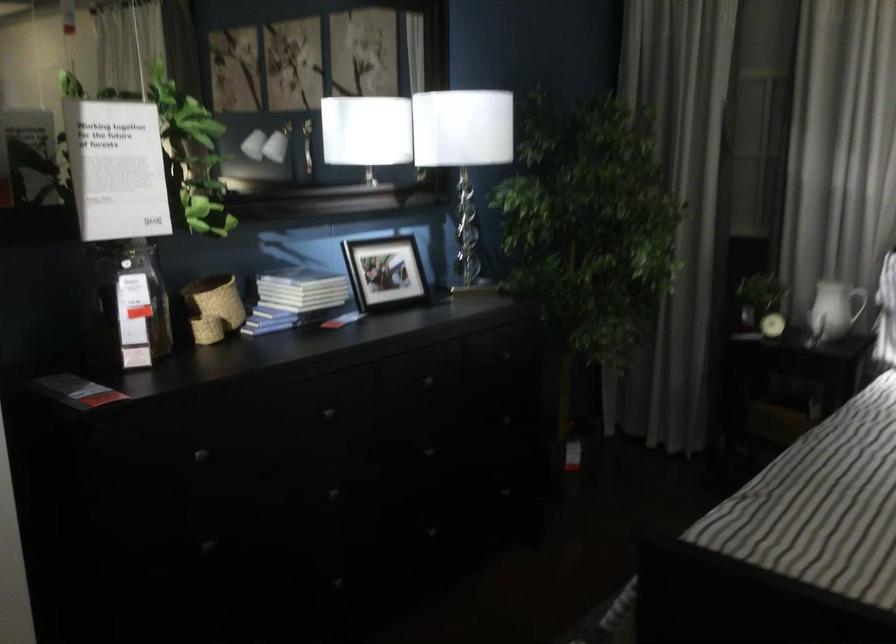
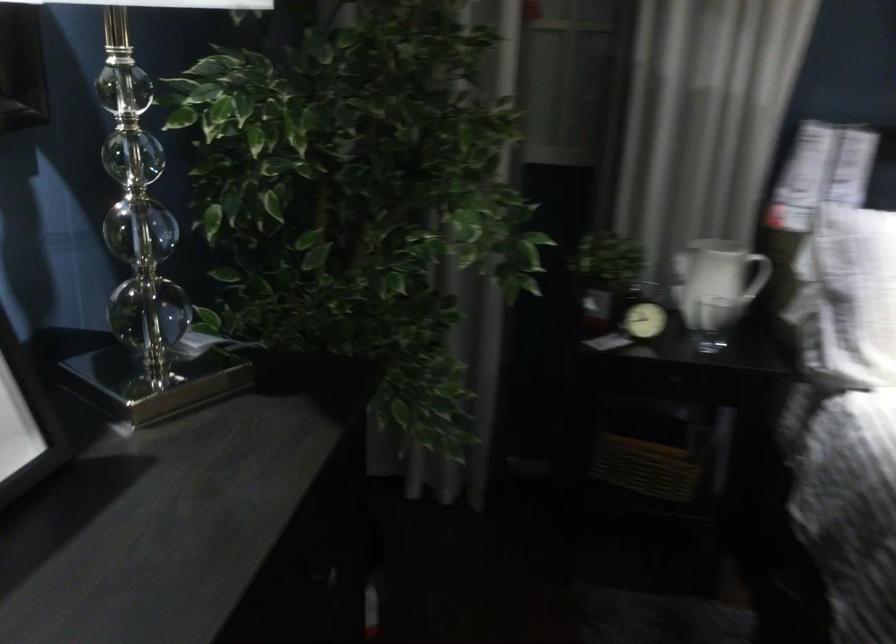
Find the pixel in the second image that matches point 784,413 in the first image.

(645, 467)